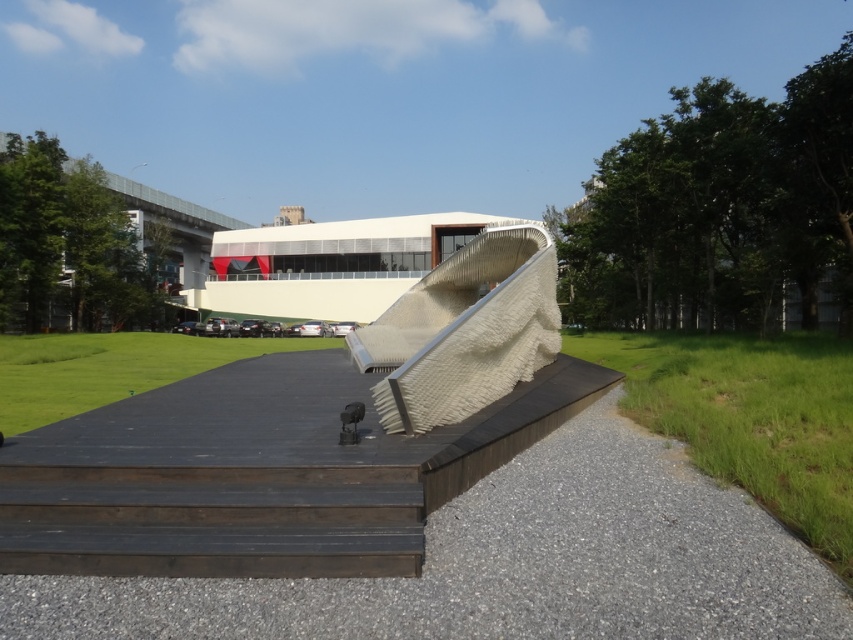
Which is above, gray gravel at lower center or white textured ramp at center?

white textured ramp at center is above.

Does gray gravel at lower center appear under white textured ramp at center?

Indeed, gray gravel at lower center is positioned under white textured ramp at center.

Who is more forward, (445,547) or (415,371)?

Positioned in front is point (445,547).

At what (x,y) coordinates should I click in order to perform the action: click on gray gravel at lower center. Please return your answer as a coordinate pair (x, y). The height and width of the screenshot is (640, 853). Looking at the image, I should click on (509, 564).

Which is above, green grass at lower right or white textured ramp at center?

white textured ramp at center

Identify the location of green grass at lower right. (749, 417).

Does white textured ramp at center lie behind green grass at center?

No, it is not.

Does white textured ramp at center have a greater height compared to green grass at center?

Yes.

Is point (453, 404) positioned after point (137, 365)?

No, it is in front of (137, 365).

Locate an element on the screen. white textured ramp at center is located at coordinates (463, 330).